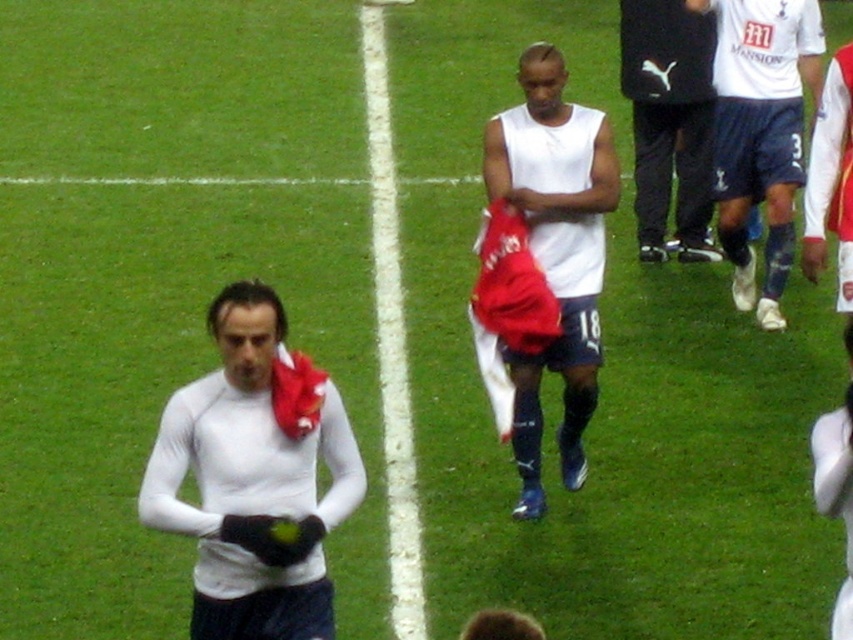
You are a photographer positioned at the edge of the soccer field. You want to take a photo of both the white matte jersey at center and the black puma tracksuit at center. Which one will appear larger in your photo?

The white matte jersey at center will appear larger in the photo because it is closer to the viewer than the black puma tracksuit at center.

You are a soccer coach analyzing the field. You notice a point at coordinates (669, 122) on the field. What object is located at that point?

The point at coordinates (669, 122) indicates the location of the black puma tracksuit at center.

You are a soccer coach analyzing the field. You notice the white matte jersey at center and the white smooth line at center. How far apart are these two elements?

The white matte jersey at center and the white smooth line at center are 1.89 meters apart.